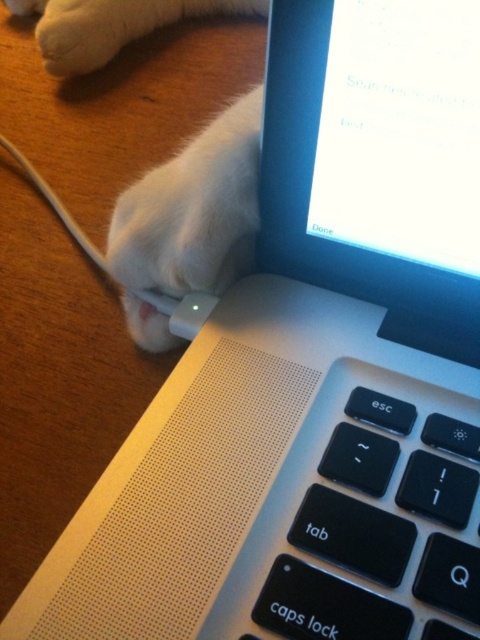
From the picture: Does matte black screen at upper right have a lesser height compared to black matte keyboard at center?

In fact, matte black screen at upper right may be taller than black matte keyboard at center.

What do you see at coordinates (377, 161) in the screenshot?
I see `matte black screen at upper right` at bounding box center [377, 161].

You are a GUI agent. You are given a task and a screenshot of the screen. Output one action in this format:
    pyautogui.click(x=<x>, y=<y>)
    Task: Click on the matte black screen at upper right
    The width and height of the screenshot is (480, 640).
    Given the screenshot: What is the action you would take?
    pyautogui.click(x=377, y=161)